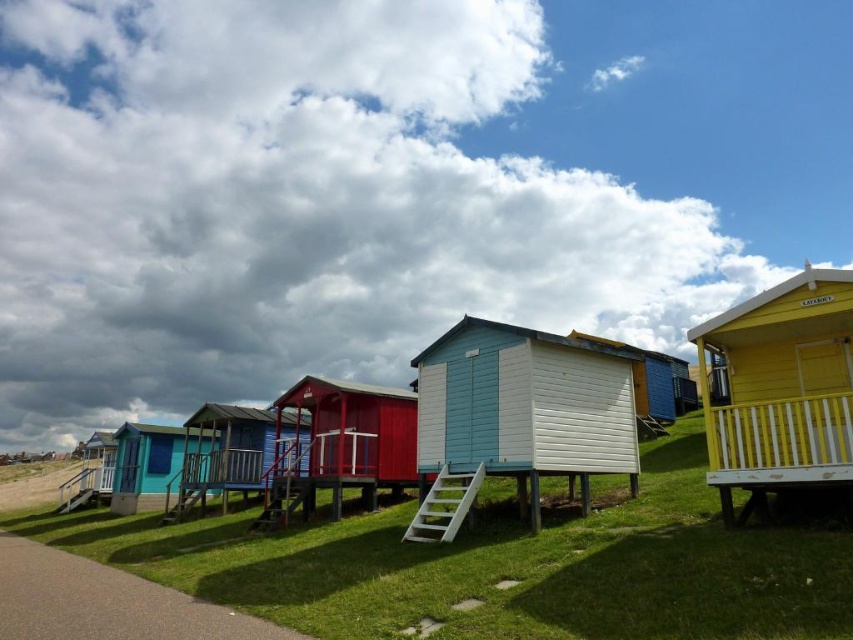
You are a maintenance worker who needs to inspect the light blue wooden beach hut at center and the yellow painted wood beach hut at right. The path between them is narrow. Can you walk directly between them without stepping around any obstacles?

The light blue wooden beach hut at center and yellow painted wood beach hut at right are 2.81 meters apart, so yes, you can walk directly between them without needing to step around any obstacles as the distance is sufficient for a clear path.